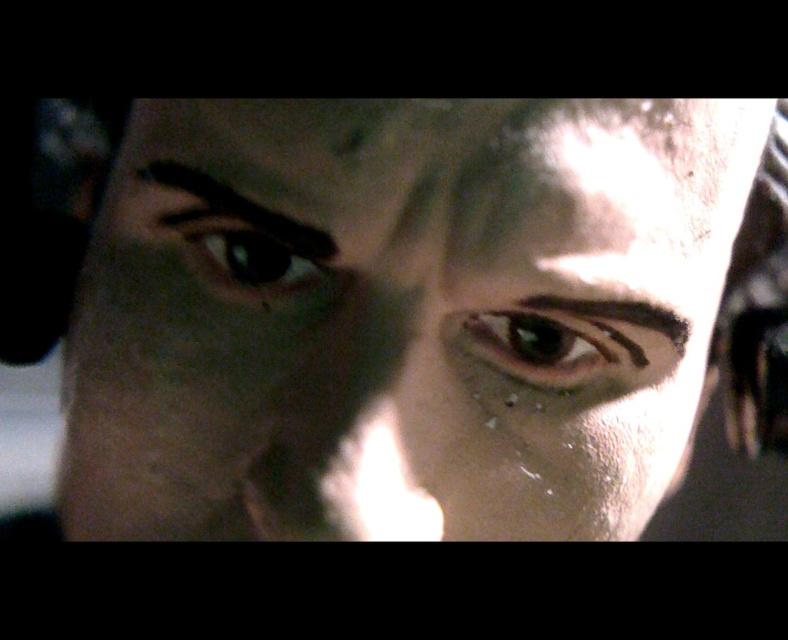
Question: Does dark brown hair at upper left appear on the right side of brown matte eyebrow at center?

Choices:
 (A) no
 (B) yes

Answer: (A)

Question: Where is slick skin face at center located in relation to brown matte eyebrow at center in the image?

Choices:
 (A) below
 (B) above

Answer: (A)

Question: Estimate the real-world distances between objects in this image. Which object is farther from the brown matte eye at center?

Choices:
 (A) smooth skin forehead at center
 (B) brown matte eyebrow at center

Answer: (A)

Question: Can you confirm if smooth skin forehead at center is wider than brown matte eyebrow at center?

Choices:
 (A) yes
 (B) no

Answer: (A)

Question: Estimate the real-world distances between objects in this image. Which object is closer to the slick skin face at center?

Choices:
 (A) brown matte eye at center
 (B) dark brown hair at upper left
 (C) smooth skin forehead at center

Answer: (C)

Question: Considering the real-world distances, which object is farthest from the brown matte eye at center?

Choices:
 (A) smooth skin forehead at center
 (B) black glossy eye at upper left
 (C) slick skin face at center
 (D) brown matte eyebrow at center

Answer: (B)